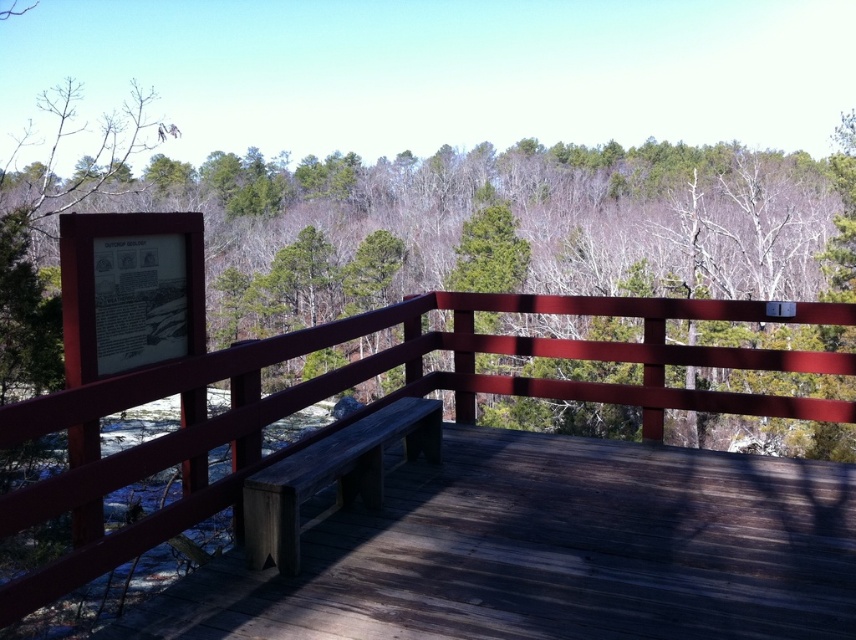
You are a park ranger who needs to place a new information board on the wooden observation deck. The current green matte sign at upper left and the wooden bench at center are already present. Which object should you avoid placing a new sign near if you want the new sign to be more noticeable?

The green matte sign at upper left is larger in size than the wooden bench at center. To make the new sign more noticeable, avoid placing it near the green matte sign at upper left since it is already large and might overshadow the new sign.

You are a park ranger checking the observation deck. You need to place a new rectangular notice that is 1.2 meters wide. The notice must be placed on either the green matte sign at upper left or the wooden bench at center. Based on their widths, which object can accommodate the notice?

The green matte sign at upper left has a greater width than the wooden bench at center, so the notice can be placed on the green matte sign at upper left.